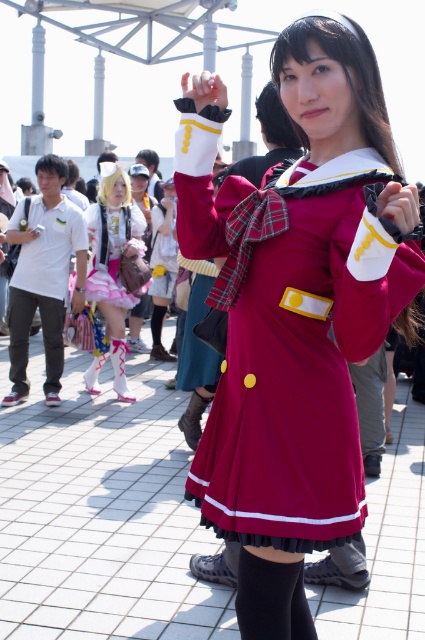
You are a photographer at the event and need to position two models wearing the matte red dress at center and the pastel chiffon dress at center for a group photo. Which dress should you place closer to the camera to ensure both models are visible clearly?

The matte red dress at center is bigger than the pastel chiffon dress at center, so you should place the pastel chiffon dress at center closer to the camera to ensure both models are visible clearly.

You are taking a photo of the lively outdoor scene at a cosplay convention. You notice two points in the image labeled as point (263, 280) and point (59, 337). Which point is closer to your camera?

Point (263, 280) is closer to the camera than point (59, 337).

You are a photographer at the event and want to capture both the pastel chiffon dress at center and the pastel pink satin dress at center in a single frame. Which dress should you position slightly to the left side of your camera frame to include both?

To include both the pastel chiffon dress at center and the pastel pink satin dress at center in the frame, position the pastel chiffon dress at center to the left side since it is already located to the left of the pastel pink satin dress at center.